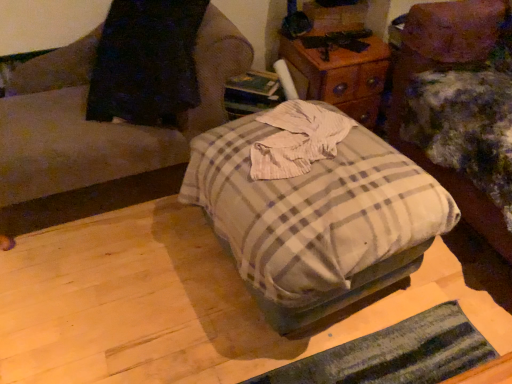
Question: In terms of height, does wooden nightstand at upper center look taller or shorter compared to plaid fabric ottoman at center, which is the 1th furniture in left-to-right order?

Choices:
 (A) tall
 (B) short

Answer: (B)

Question: From the image's perspective, is wooden nightstand at upper center above or below plaid fabric ottoman at center, the second furniture when ordered from right to left?

Choices:
 (A) below
 (B) above

Answer: (B)

Question: Based on their relative distances, which object is nearer to the plaid fabric ottoman at center, the second furniture when ordered from right to left?

Choices:
 (A) plaid fabric ottoman at center
 (B) plaid fabric ottoman at center, the first furniture viewed from the right
 (C) wooden nightstand at upper center

Answer: (A)

Question: Which object is positioned farthest from the plaid fabric ottoman at center?

Choices:
 (A) plaid fabric ottoman at center, which is the 1th furniture in left-to-right order
 (B) plaid fabric ottoman at center, arranged as the second furniture when viewed from the left
 (C) wooden nightstand at upper center

Answer: (C)